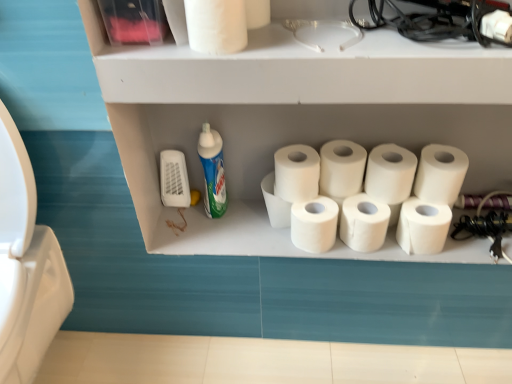
Question: Which direction should I rotate to look at white matte toilet paper at upper center, the 11th toilet paper in the right-to-left sequence?

Choices:
 (A) left
 (B) right

Answer: (A)

Question: Does white matte toilet paper at upper right, placed as the 10th toilet paper when sorted from left to right, have a larger size compared to white matte toilet paper at center, the eighth toilet paper from the right?

Choices:
 (A) yes
 (B) no

Answer: (B)

Question: Is white matte toilet paper at upper right, placed as the 10th toilet paper when sorted from left to right, taller than white matte toilet paper at center, which ranks as the 4th toilet paper in left-to-right order?

Choices:
 (A) yes
 (B) no

Answer: (B)

Question: Is white matte toilet paper at upper right, placed as the 10th toilet paper when sorted from left to right, not close to white matte toilet paper at center, which ranks as the 4th toilet paper in left-to-right order?

Choices:
 (A) yes
 (B) no

Answer: (B)

Question: Is white matte toilet paper at upper right, which is the 2th toilet paper from right to left, at the left side of white matte toilet paper at center, which ranks as the 4th toilet paper in left-to-right order?

Choices:
 (A) no
 (B) yes

Answer: (A)

Question: Considering the relative sizes of white matte toilet paper at upper right, which is the 2th toilet paper from right to left, and white matte toilet paper at center, which ranks as the 4th toilet paper in left-to-right order, in the image provided, is white matte toilet paper at upper right, which is the 2th toilet paper from right to left, thinner than white matte toilet paper at center, which ranks as the 4th toilet paper in left-to-right order,?

Choices:
 (A) no
 (B) yes

Answer: (B)

Question: Is white matte toilet paper at upper right, which is the 2th toilet paper from right to left, touching white matte toilet paper at center, which ranks as the 4th toilet paper in left-to-right order?

Choices:
 (A) no
 (B) yes

Answer: (A)

Question: Does white matte toilet paper at center, which appears as the 5th toilet paper when viewed from the right, appear on the left side of white matte toilet paper at center, which ranks as the 6th toilet paper in left-to-right order?

Choices:
 (A) no
 (B) yes

Answer: (A)

Question: From the image's perspective, would you say white matte toilet paper at center, the seventh toilet paper from the left, is shown under white matte toilet paper at center, the sixth toilet paper viewed from the right?

Choices:
 (A) yes
 (B) no

Answer: (A)

Question: Is white matte toilet paper at center, the seventh toilet paper from the left, positioned with its back to white matte toilet paper at center, which ranks as the 6th toilet paper in left-to-right order?

Choices:
 (A) yes
 (B) no

Answer: (B)

Question: Does white matte toilet paper at center, which appears as the 5th toilet paper when viewed from the right, appear on the right side of white matte toilet paper at center, which ranks as the 6th toilet paper in left-to-right order?

Choices:
 (A) no
 (B) yes

Answer: (B)

Question: Is white matte toilet paper at center, the seventh toilet paper from the left, with white matte toilet paper at center, the sixth toilet paper viewed from the right?

Choices:
 (A) yes
 (B) no

Answer: (A)

Question: Can you confirm if white matte toilet paper at center, the seventh toilet paper from the left, is thinner than white matte toilet paper at center, which ranks as the 6th toilet paper in left-to-right order?

Choices:
 (A) yes
 (B) no

Answer: (A)

Question: From the image's perspective, is white matte toilet paper at center, which is counted as the fifth toilet paper, starting from the left, under white matte toilet paper at upper right, which is the 2th toilet paper from right to left?

Choices:
 (A) no
 (B) yes

Answer: (B)